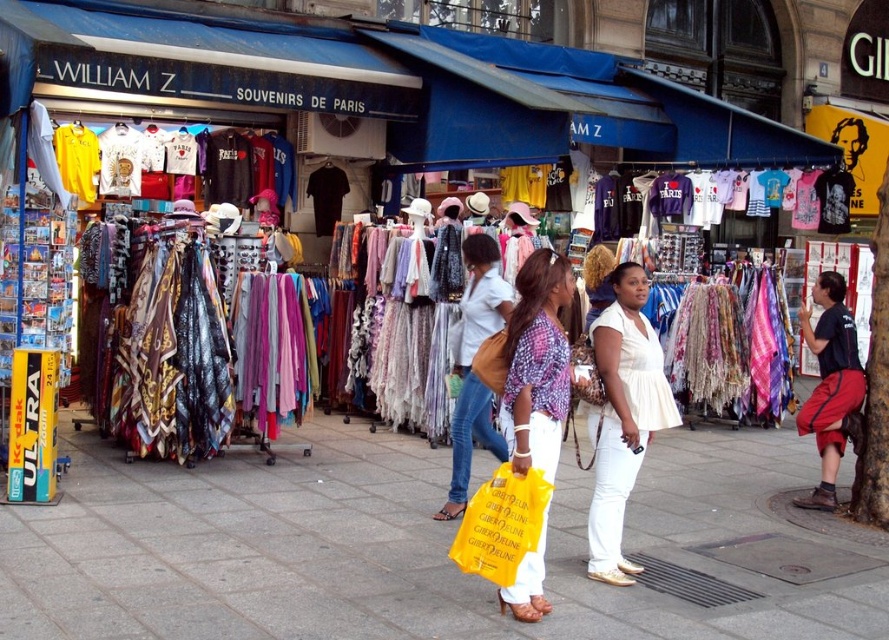
In the scene shown: You are a traveler who wants to buy a souvenir that can be easily carried in your backpack. You see the white cotton blouse at center and the matte brown handbag at center. Which item would take up more space in your backpack?

The white cotton blouse at center is larger in size than the matte brown handbag at center, so the white cotton blouse at center would take up more space in your backpack.

You are a customer in the souvenir shop and you want to buy a blouse that is wider. Which one should you choose between the matte purple blouse at center and the matte white blouse at center?

The matte purple blouse at center is wider than the matte white blouse at center, so you should choose the matte purple blouse at center.